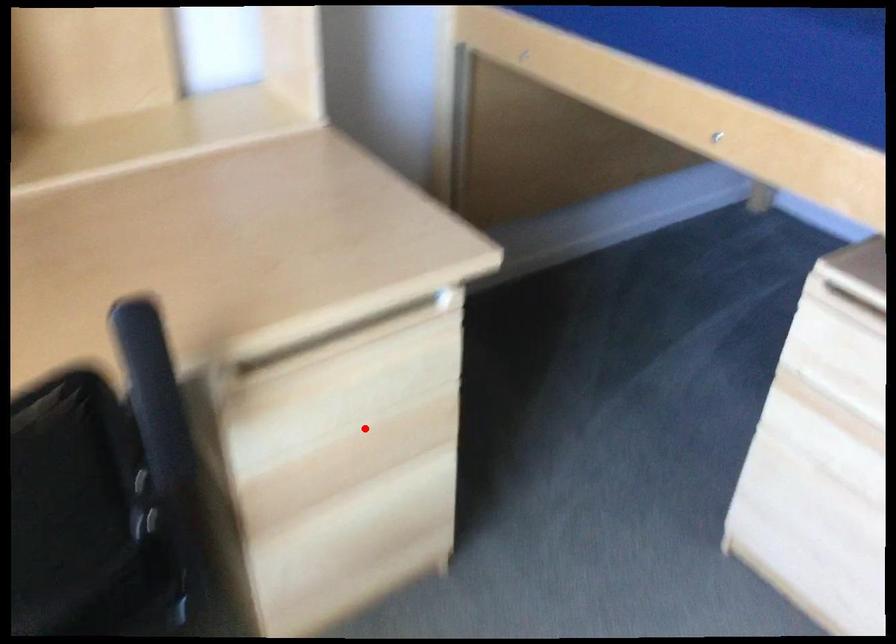
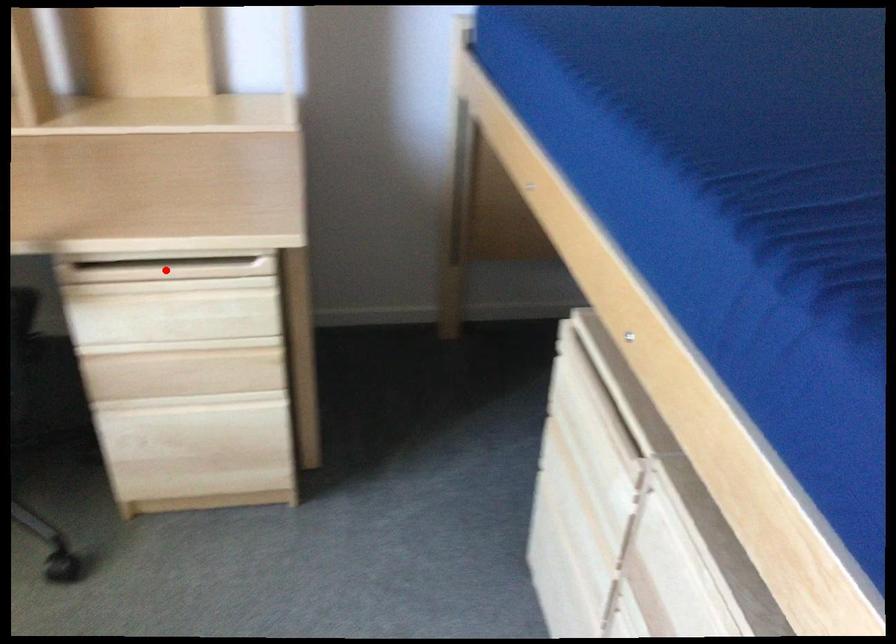
In the scene shown: I am providing you with two images of the same scene from different viewpoints. A red point is marked on the first image and another point is marked on the second image. Is the red point in image1 aligned with the point shown in image2?

No